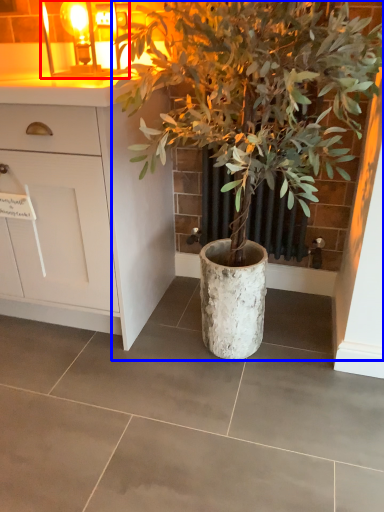
Question: Which object appears closest to the camera in this image, light fixture (highlighted by a red box) or houseplant (highlighted by a blue box)?

Choices:
 (A) light fixture
 (B) houseplant

Answer: (B)